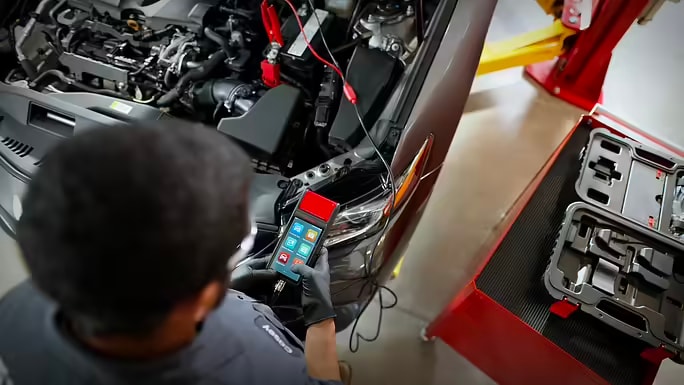
The image size is (684, 385). I want to click on lights, so click(368, 219).